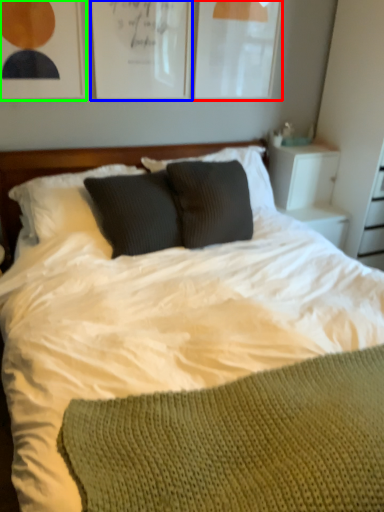
Question: Which is farther away from picture frame (highlighted by a red box)? picture frame (highlighted by a blue box) or picture frame (highlighted by a green box)?

Choices:
 (A) picture frame
 (B) picture frame

Answer: (B)